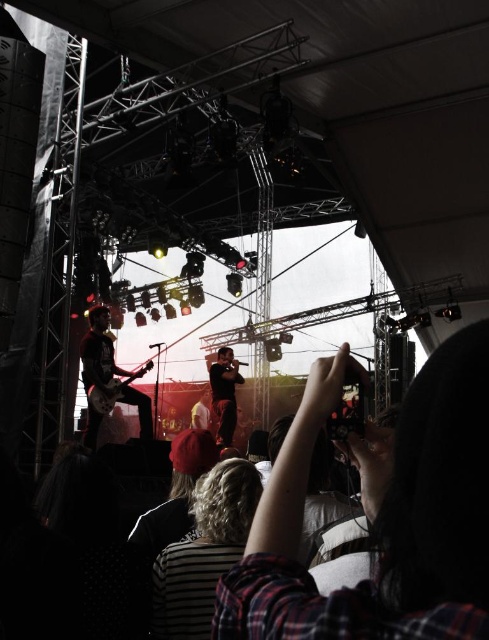
Can you confirm if plaid fabric shirt at center is positioned to the right of striped fabric shirt at center?

Yes, plaid fabric shirt at center is to the right of striped fabric shirt at center.

This screenshot has width=489, height=640. Find the location of `plaid fabric shirt at center`. plaid fabric shirt at center is located at coordinates (380, 513).

Does point (343, 362) come behind point (226, 525)?

No, it is in front of (226, 525).

Identify the location of plaid fabric shirt at center. (380, 513).

Measure the distance between striped fabric shirt at center and shiny black guitar at left.

striped fabric shirt at center is 22.42 meters away from shiny black guitar at left.

Between striped fabric shirt at center and shiny black guitar at left, which one has more height?

shiny black guitar at left is taller.

Where is `striped fabric shirt at center`? This screenshot has height=640, width=489. striped fabric shirt at center is located at coordinates (203, 552).

Where is `striped fabric shirt at center`? The image size is (489, 640). striped fabric shirt at center is located at coordinates (203, 552).

Is plaid fabric shirt at center further to the viewer compared to matte black guitar at left?

No.

Measure the distance between point (383, 468) and camera.

Point (383, 468) is 20.35 meters away from camera.

Where is `plaid fabric shirt at center`? plaid fabric shirt at center is located at coordinates (380, 513).